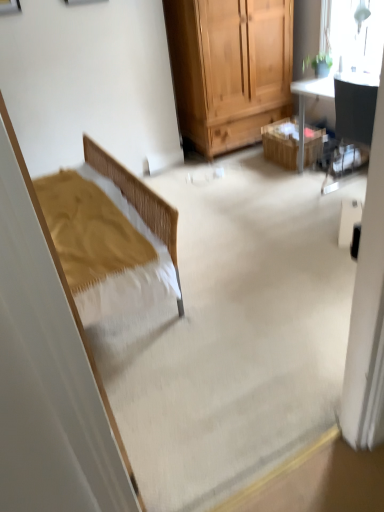
This screenshot has height=512, width=384. Describe the element at coordinates (353, 33) in the screenshot. I see `transparent glass window at upper right` at that location.

At what (x,y) coordinates should I click in order to perform the action: click on matte black chair at upper right. Please return your answer as a coordinate pair (x, y). This screenshot has width=384, height=512. Looking at the image, I should click on (355, 106).

The image size is (384, 512). Find the location of `transparent glass window at upper right`. transparent glass window at upper right is located at coordinates (353, 33).

In terms of width, does transparent glass window at upper right look wider or thinner when compared to matte black chair at upper right?

Clearly, transparent glass window at upper right has less width compared to matte black chair at upper right.

From the image's perspective, is transparent glass window at upper right above matte black chair at upper right?

Yes, from the image's perspective, transparent glass window at upper right is over matte black chair at upper right.

In the scene shown: Which is more distant, (334, 37) or (348, 140)?

Point (334, 37)

Does transparent glass window at upper right turn towards matte black chair at upper right?

No, transparent glass window at upper right is not turned towards matte black chair at upper right.

Is wooden picnic basket at center shorter than matte black chair at upper right?

Correct, wooden picnic basket at center is not as tall as matte black chair at upper right.

Is point (264, 133) closer or farther from the camera than point (365, 136)?

Clearly, point (264, 133) is more distant from the camera than point (365, 136).

Between wooden picnic basket at center and matte black chair at upper right, which one has smaller width?

wooden picnic basket at center.

At what (x,y) coordinates should I click in order to perform the action: click on picnic basket behind the matte black chair at upper right. Please return your answer as a coordinate pair (x, y). Image resolution: width=384 pixels, height=512 pixels. Looking at the image, I should click on (282, 143).

Locate an element on the screen. This screenshot has height=512, width=384. picnic basket below the transparent glass window at upper right (from the image's perspective) is located at coordinates (282, 143).

Considering the relative positions of wooden picnic basket at center and transparent glass window at upper right in the image provided, is wooden picnic basket at center to the left of transparent glass window at upper right from the viewer's perspective?

Correct, you'll find wooden picnic basket at center to the left of transparent glass window at upper right.

Is wooden picnic basket at center wider or thinner than transparent glass window at upper right?

→ In the image, wooden picnic basket at center appears to be wider than transparent glass window at upper right.

From a real-world perspective, who is located lower, matte black chair at upper right or transparent glass window at upper right?

matte black chair at upper right is physically lower.

Locate an element on the screen. This screenshot has height=512, width=384. window located behind the matte black chair at upper right is located at coordinates (353, 33).

Considering the positions of point (365, 133) and point (353, 6), is point (365, 133) closer or farther from the camera than point (353, 6)?

Point (365, 133).

The image size is (384, 512). I want to click on picnic basket on the left of transparent glass window at upper right, so click(282, 143).

Considering the relative positions of transparent glass window at upper right and wooden picnic basket at center in the image provided, is transparent glass window at upper right to the right of wooden picnic basket at center from the viewer's perspective?

Indeed, transparent glass window at upper right is positioned on the right side of wooden picnic basket at center.

Looking at this image, from their relative heights in the image, would you say transparent glass window at upper right is taller or shorter than wooden picnic basket at center?

In the image, transparent glass window at upper right appears to be taller than wooden picnic basket at center.

Is matte black chair at upper right facing towards wooden picnic basket at center?

No, matte black chair at upper right is not facing towards wooden picnic basket at center.

Does matte black chair at upper right have a lesser height compared to wooden picnic basket at center?

Incorrect, the height of matte black chair at upper right does not fall short of that of wooden picnic basket at center.

From the image's perspective, is matte black chair at upper right above or below wooden picnic basket at center?

From the image's perspective, matte black chair at upper right appears below wooden picnic basket at center.

From a real-world perspective, is matte black chair at upper right on wooden picnic basket at center?

Correct, in the physical world, matte black chair at upper right is higher than wooden picnic basket at center.

Where is `chair on the right of transparent glass window at upper right`? The width and height of the screenshot is (384, 512). chair on the right of transparent glass window at upper right is located at coordinates (355, 106).

Locate an element on the screen. picnic basket beneath the matte black chair at upper right (from a real-world perspective) is located at coordinates (282, 143).

Estimate the real-world distances between objects in this image. Which object is closer to matte black chair at upper right, wooden picnic basket at center or transparent glass window at upper right?

Based on the image, transparent glass window at upper right appears to be nearer to matte black chair at upper right.

From the picture: From the image, which object appears to be nearer to wooden picnic basket at center, matte black chair at upper right or transparent glass window at upper right?

matte black chair at upper right is closer to wooden picnic basket at center.

Estimate the real-world distances between objects in this image. Which object is closer to transparent glass window at upper right, wooden picnic basket at center or matte black chair at upper right?

matte black chair at upper right.

Looking at the image, which one is located closer to matte black chair at upper right, transparent glass window at upper right or wooden picnic basket at center?

Among the two, transparent glass window at upper right is located nearer to matte black chair at upper right.

Looking at the image, which one is located further to transparent glass window at upper right, matte black chair at upper right or wooden picnic basket at center?

wooden picnic basket at center is further to transparent glass window at upper right.

Estimate the real-world distances between objects in this image. Which object is closer to wooden picnic basket at center, transparent glass window at upper right or matte black chair at upper right?

Among the two, matte black chair at upper right is located nearer to wooden picnic basket at center.

The width and height of the screenshot is (384, 512). I want to click on window positioned between matte black chair at upper right and wooden picnic basket at center from near to far, so click(353, 33).